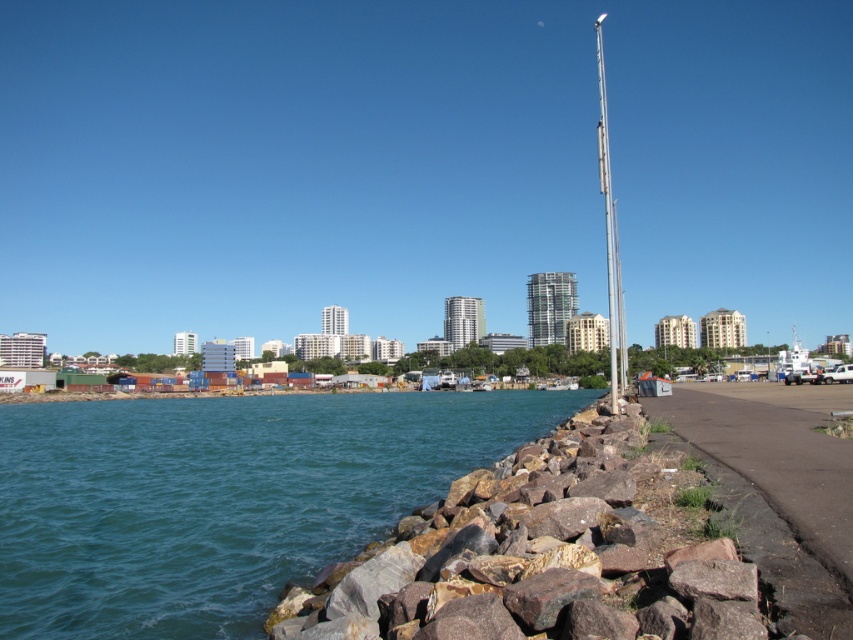
You are a photographer planning to capture the waterfront scene. You have a camera with a 30cm wide frame. The rocky at lower right and the silver metallic flag pole at right are both in your shot. Which object will occupy more of the frame?

The silver metallic flag pole at right occupies more space than the rocky at lower right, so it will take up more of the 30cm wide frame.

You are standing on the rocky shoreline and want to walk from the teal rock at lower left to the silver metallic flag pole at right. Which direction should you move to get closer to the flag pole?

Since the teal rock at lower left is closer to the viewer than the silver metallic flag pole at right, you should move towards the right along the shoreline to get closer to the flag pole.